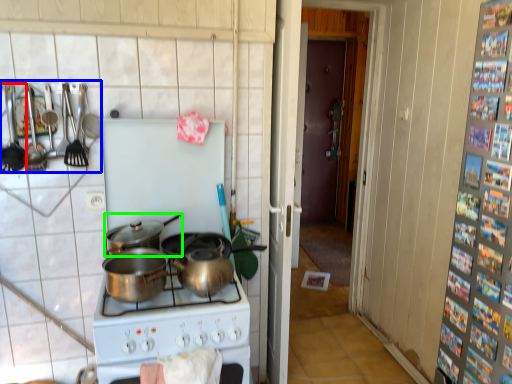
Question: Which is farther away from kitchen appliance (highlighted by a red box)? kitchen appliance (highlighted by a blue box) or kitchen appliance (highlighted by a green box)?

Choices:
 (A) kitchen appliance
 (B) kitchen appliance

Answer: (B)